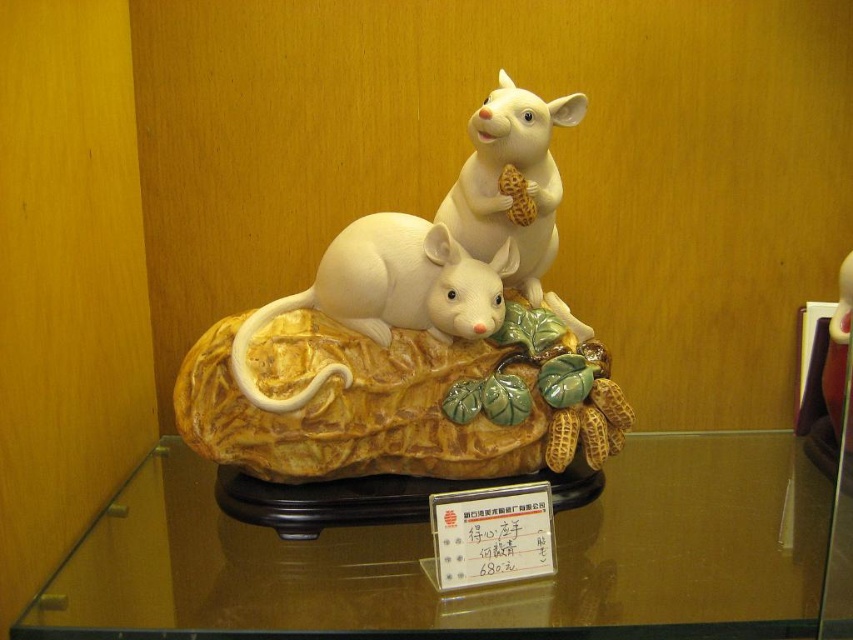
Who is shorter, transparent glass table at center or white glossy mice at center?

Standing shorter between the two is transparent glass table at center.

Does transparent glass table at center appear on the right side of white glossy mice at center?

Correct, you'll find transparent glass table at center to the right of white glossy mice at center.

Does point (815, 612) lie behind point (271, 401)?

No, it is in front of (271, 401).

The image size is (853, 640). I want to click on transparent glass table at center, so click(473, 592).

Is white glossy mouse at center above white glossy mouse at upper center?

No, white glossy mouse at center is not above white glossy mouse at upper center.

Measure the distance between point (x=345, y=308) and camera.

The distance of point (x=345, y=308) from camera is 4.16 feet.

At what (x,y) coordinates should I click in order to perform the action: click on white glossy mouse at center. Please return your answer as a coordinate pair (x, y). The height and width of the screenshot is (640, 853). Looking at the image, I should click on (387, 292).

What do you see at coordinates (421, 337) in the screenshot? I see `white glossy mice at center` at bounding box center [421, 337].

The width and height of the screenshot is (853, 640). Identify the location of white glossy mice at center. (421, 337).